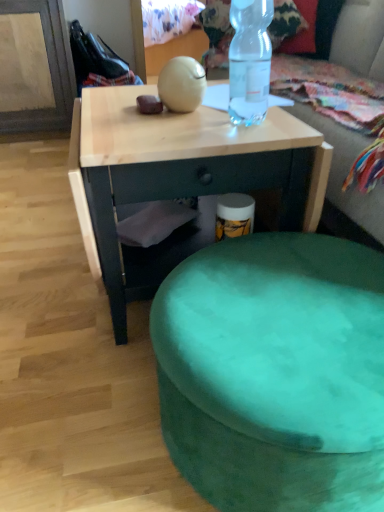
Describe the element at coordinates (275, 373) in the screenshot. I see `velvet green ottoman at lower center` at that location.

Find the location of a particular element. natural wood desk at center is located at coordinates (181, 170).

Is green fabric bean bag at upper center far from velvet green ottoman at lower center?

Yes, green fabric bean bag at upper center and velvet green ottoman at lower center are quite far apart.

From the image's perspective, is green fabric bean bag at upper center located above or below velvet green ottoman at lower center?

Based on their image positions, green fabric bean bag at upper center is located above velvet green ottoman at lower center.

How far apart are green fabric bean bag at upper center and velvet green ottoman at lower center?

green fabric bean bag at upper center is 1.52 meters from velvet green ottoman at lower center.

Considering the sizes of objects green fabric bean bag at upper center and velvet green ottoman at lower center in the image provided, who is bigger, green fabric bean bag at upper center or velvet green ottoman at lower center?

Bigger between the two is green fabric bean bag at upper center.

Is velvet green ottoman at lower center behind green fabric bean bag at upper center?

That is False.

Between velvet green ottoman at lower center and green fabric bean bag at upper center, which one has larger width?

green fabric bean bag at upper center is wider.

Which is more to the right, velvet green ottoman at lower center or green fabric bean bag at upper center?

Positioned to the right is green fabric bean bag at upper center.

Looking at this image, is velvet green ottoman at lower center not close to green fabric bean bag at upper center?

velvet green ottoman at lower center is far away from green fabric bean bag at upper center.

Looking at this image, is transparent plastic bottle at upper center not near natural wood desk at center?

Actually, transparent plastic bottle at upper center and natural wood desk at center are a little close together.

Considering the relative sizes of transparent plastic bottle at upper center and natural wood desk at center in the image provided, is transparent plastic bottle at upper center wider than natural wood desk at center?

Incorrect, the width of transparent plastic bottle at upper center does not surpass that of natural wood desk at center.

Which of these two, velvet green ottoman at lower center or natural wood desk at center, is thinner?

Thinner between the two is velvet green ottoman at lower center.

From the image's perspective, which is above, velvet green ottoman at lower center or natural wood desk at center?

From the image's view, natural wood desk at center is above.

Based on the photo, is velvet green ottoman at lower center taller than natural wood desk at center?

Incorrect, the height of velvet green ottoman at lower center is not larger of that of natural wood desk at center.

This screenshot has width=384, height=512. Identify the location of stool in front of the natural wood desk at center. (275, 373).

From a real-world perspective, is natural wood desk at center positioned above or below velvet green ottoman at lower center?

natural wood desk at center is above velvet green ottoman at lower center.

Does natural wood desk at center lie in front of velvet green ottoman at lower center?

No, natural wood desk at center is further to the viewer.

Would you say natural wood desk at center is inside or outside velvet green ottoman at lower center?

natural wood desk at center cannot be found inside velvet green ottoman at lower center.

Is natural wood desk at center not close to velvet green ottoman at lower center?

No, there isn't a large distance between natural wood desk at center and velvet green ottoman at lower center.

Can you tell me how much green fabric bean bag at upper center and transparent plastic bottle at upper center differ in facing direction?

The facing directions of green fabric bean bag at upper center and transparent plastic bottle at upper center are 0.00296 degrees apart.

Is green fabric bean bag at upper center turned away from transparent plastic bottle at upper center?

green fabric bean bag at upper center is not turned away from transparent plastic bottle at upper center.

In the scene shown: From the image's perspective, between green fabric bean bag at upper center and transparent plastic bottle at upper center, which one is located above?

green fabric bean bag at upper center is shown above in the image.

Image resolution: width=384 pixels, height=512 pixels. I want to click on bean bag chair on the right of transparent plastic bottle at upper center, so click(x=346, y=172).

I want to click on desk below the transparent plastic bottle at upper center (from the image's perspective), so click(181, 170).

Is natural wood desk at center shorter than transparent plastic bottle at upper center?

In fact, natural wood desk at center may be taller than transparent plastic bottle at upper center.

Are natural wood desk at center and transparent plastic bottle at upper center far apart?

No, natural wood desk at center is in close proximity to transparent plastic bottle at upper center.

From the image's perspective, is natural wood desk at center located beneath transparent plastic bottle at upper center?

Yes, from the image's perspective, natural wood desk at center is beneath transparent plastic bottle at upper center.

This screenshot has width=384, height=512. What are the coordinates of `stool lying in front of the green fabric bean bag at upper center` in the screenshot? It's located at (275, 373).

Where is `bean bag chair above the velvet green ottoman at lower center (from the image's perspective)`? The height and width of the screenshot is (512, 384). bean bag chair above the velvet green ottoman at lower center (from the image's perspective) is located at coordinates (346, 172).

Which object lies further to the anchor point green fabric bean bag at upper center, transparent plastic bottle at upper center or natural wood desk at center?

natural wood desk at center lies further to green fabric bean bag at upper center than the other object.

Estimate the real-world distances between objects in this image. Which object is closer to natural wood desk at center, transparent plastic bottle at upper center or velvet green ottoman at lower center?

The object closer to natural wood desk at center is transparent plastic bottle at upper center.

Based on their spatial positions, is green fabric bean bag at upper center or velvet green ottoman at lower center further from transparent plastic bottle at upper center?

green fabric bean bag at upper center is further to transparent plastic bottle at upper center.

When comparing their distances from green fabric bean bag at upper center, does transparent plastic bottle at upper center or velvet green ottoman at lower center seem closer?

Among the two, transparent plastic bottle at upper center is located nearer to green fabric bean bag at upper center.

Estimate the real-world distances between objects in this image. Which object is further from natural wood desk at center, velvet green ottoman at lower center or green fabric bean bag at upper center?

green fabric bean bag at upper center.

Considering their positions, is green fabric bean bag at upper center positioned closer to transparent plastic bottle at upper center than natural wood desk at center?

natural wood desk at center is closer to transparent plastic bottle at upper center.

From the image, which object appears to be farther from green fabric bean bag at upper center, velvet green ottoman at lower center or natural wood desk at center?

velvet green ottoman at lower center lies further to green fabric bean bag at upper center than the other object.

Considering their positions, is green fabric bean bag at upper center positioned closer to natural wood desk at center than transparent plastic bottle at upper center?

transparent plastic bottle at upper center.

I want to click on desk between transparent plastic bottle at upper center and velvet green ottoman at lower center vertically, so click(181, 170).

Locate an element on the screen. Image resolution: width=384 pixels, height=512 pixels. bottle between natural wood desk at center and green fabric bean bag at upper center is located at coordinates (249, 61).

Find the location of a particular element. This screenshot has width=384, height=512. desk between green fabric bean bag at upper center and velvet green ottoman at lower center from top to bottom is located at coordinates (181, 170).

Image resolution: width=384 pixels, height=512 pixels. I want to click on bottle between green fabric bean bag at upper center and velvet green ottoman at lower center in the up-down direction, so [249, 61].